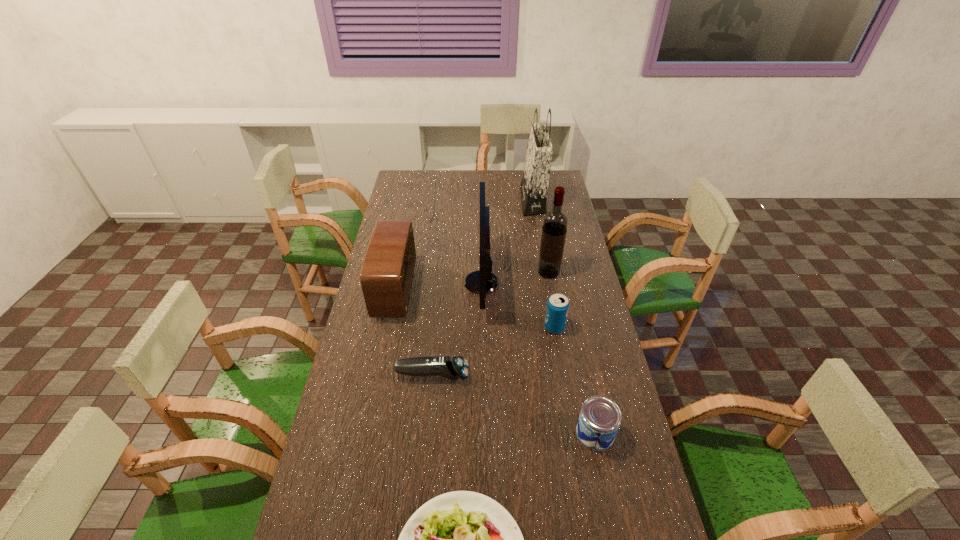
Find the location of a particular element. vacant region that satisfies the following two spatial constraints: 1. on the back side of the fifth tallest object; 2. on the left side of the wine bottle is located at coordinates (545, 273).